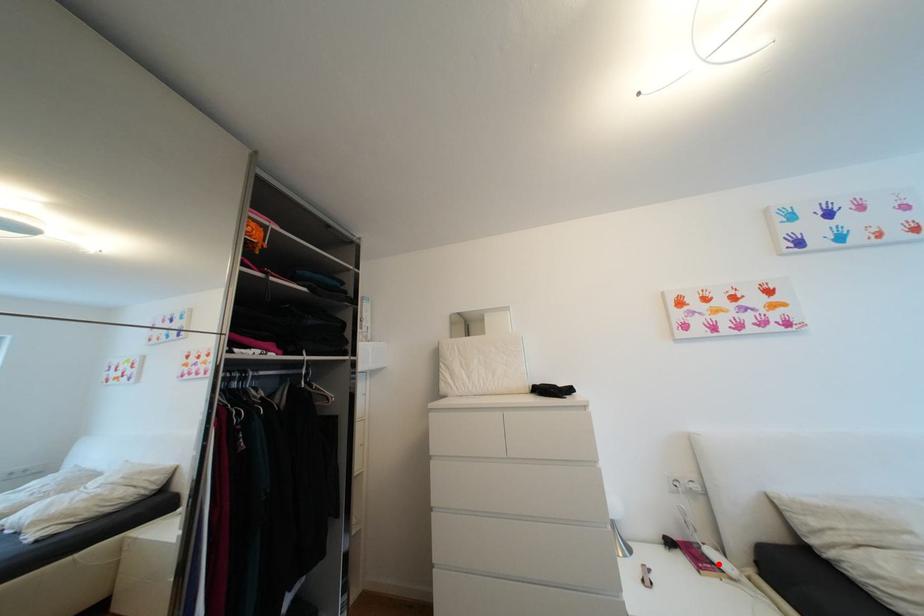
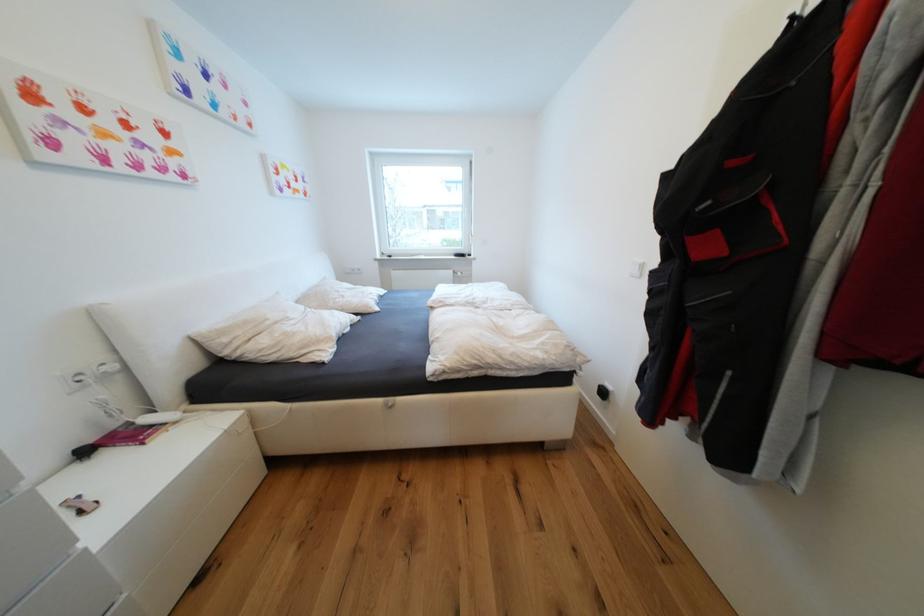
The point at the highlighted location is marked in the first image. Where is the corresponding point in the second image?

(159, 428)